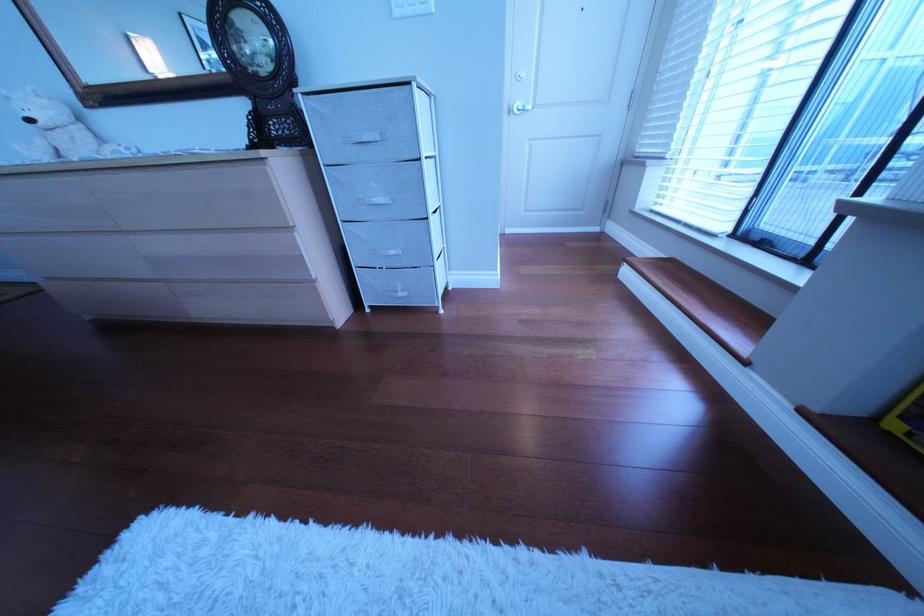
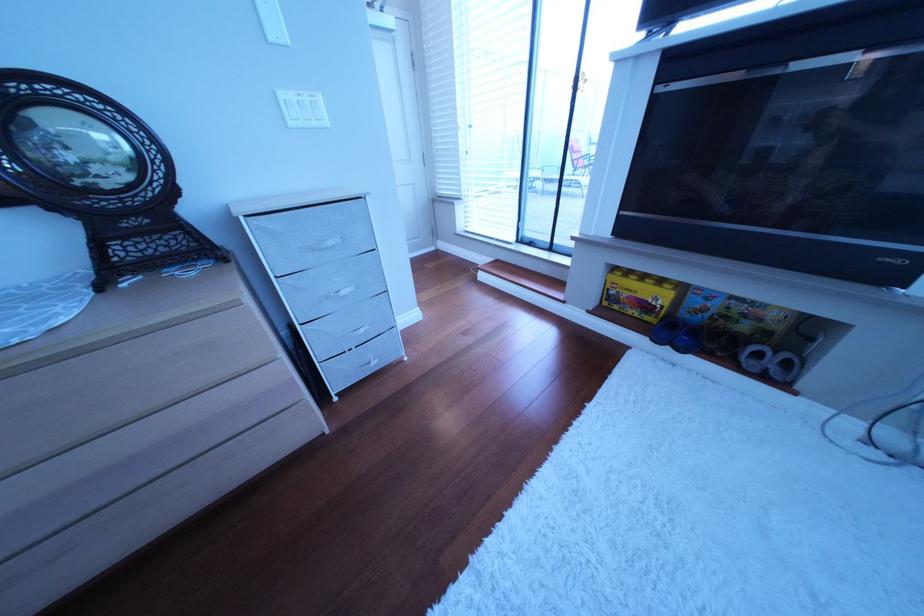
Locate, in the second image, the point that corresponds to [378,201] in the first image.

(339, 299)